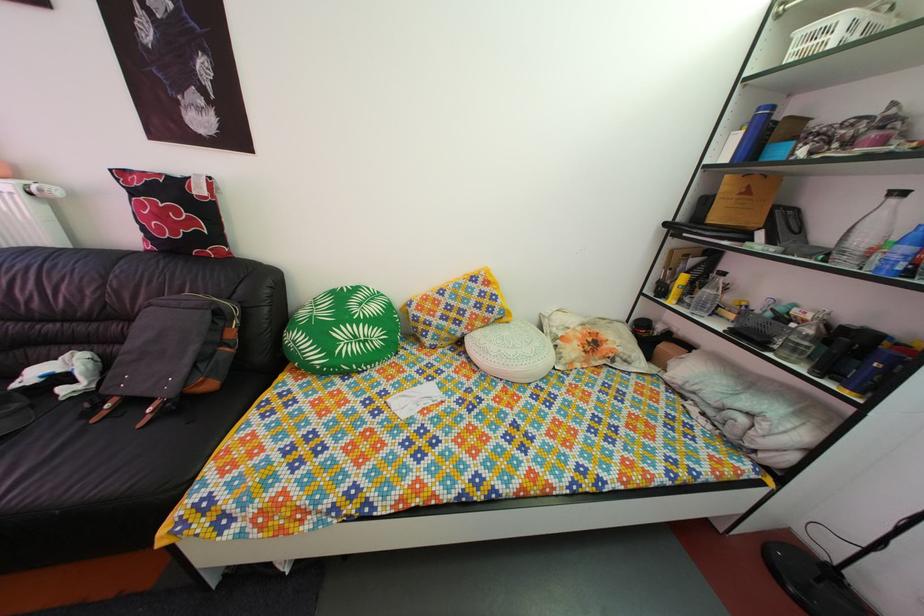
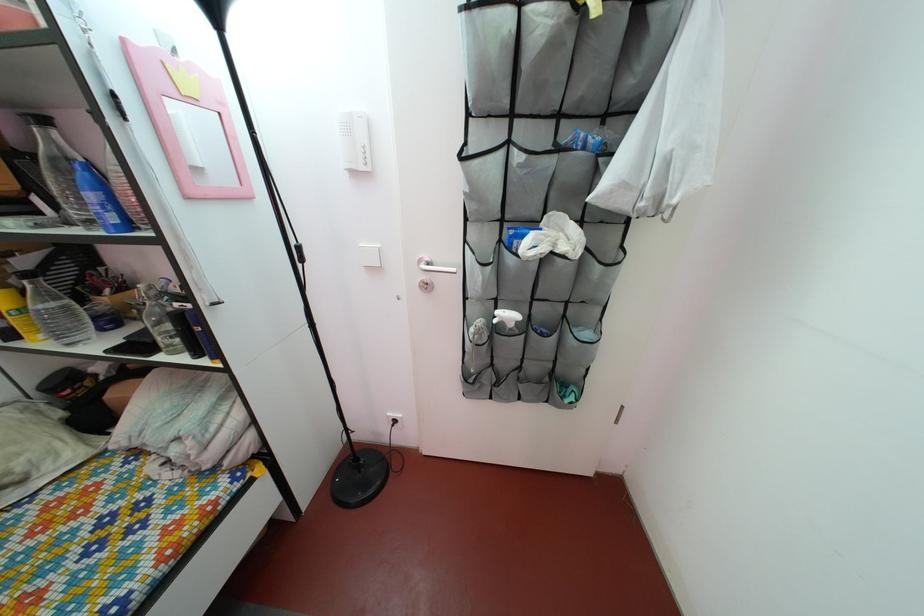
The point at (701, 270) is marked in the first image. Where is the corresponding point in the second image?

(32, 270)